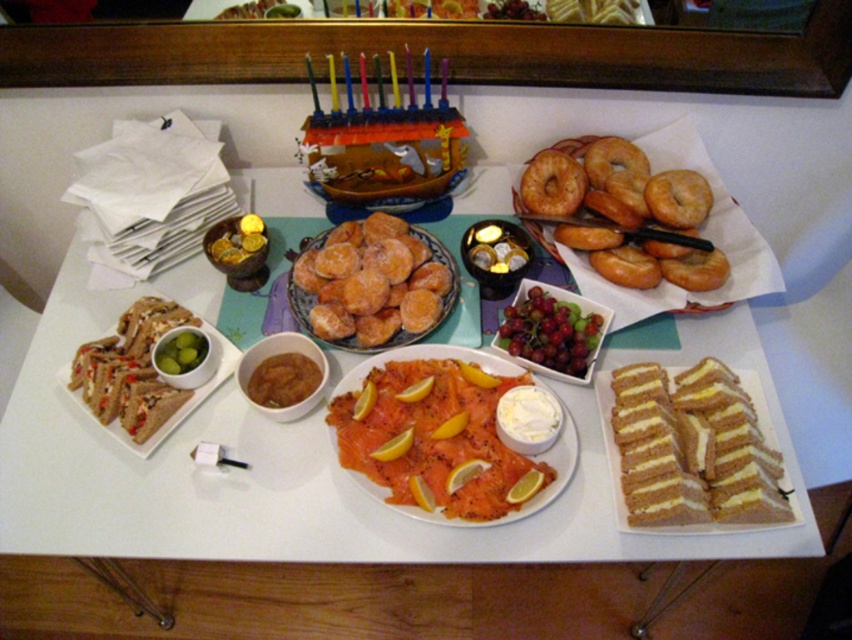
Question: Which point is farther to the camera?

Choices:
 (A) (712, 396)
 (B) (145, 305)
 (C) (162, 500)

Answer: (B)

Question: From the image, what is the correct spatial relationship of matte brown bagels at upper right in relation to white cream cheese sandwich at center?

Choices:
 (A) above
 (B) below

Answer: (A)

Question: Is white cream cheese sandwich at center to the right of glazed doughnut at upper right from the viewer's perspective?

Choices:
 (A) no
 (B) yes

Answer: (B)

Question: Among these points, which one is nearest to the camera?

Choices:
 (A) (323, 237)
 (B) (229, 568)
 (C) (435, 372)
 (D) (678, 508)

Answer: (D)

Question: Does golden glazed bagels at center appear under white bread sandwich at left?

Choices:
 (A) no
 (B) yes

Answer: (A)

Question: Which point is closer to the camera?

Choices:
 (A) (556, 593)
 (B) (580, 189)

Answer: (B)